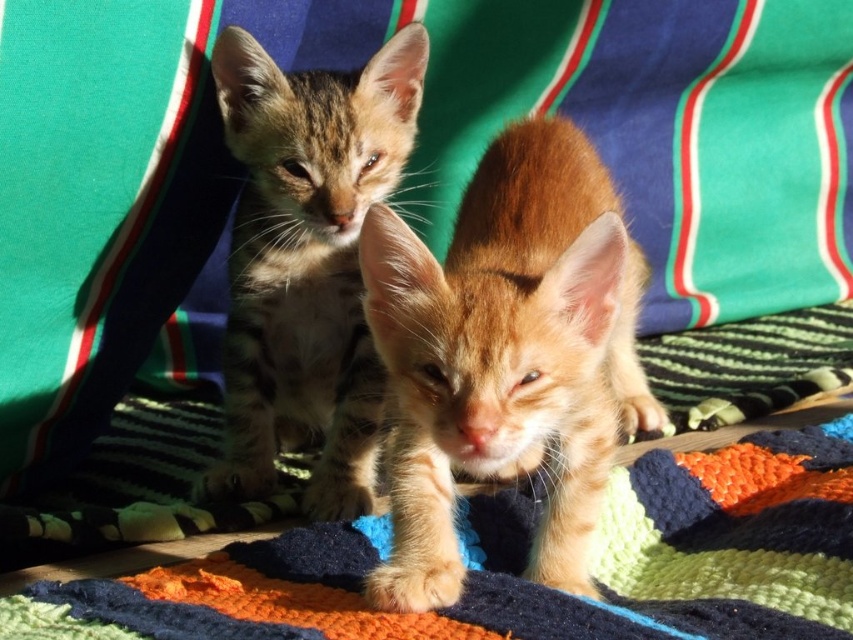
Question: Can you confirm if orange fur kitten at center is bigger than knitted wool blanket at center?

Choices:
 (A) no
 (B) yes

Answer: (B)

Question: Estimate the real-world distances between objects in this image. Which object is closer to the knitted wool blanket at center?

Choices:
 (A) tabby fur kitten at center
 (B) orange fur kitten at center

Answer: (B)

Question: Where is knitted wool blanket at center located in relation to tabby fur kitten at center in the image?

Choices:
 (A) above
 (B) below

Answer: (B)

Question: Is orange fur kitten at center closer to camera compared to knitted wool blanket at center?

Choices:
 (A) no
 (B) yes

Answer: (A)

Question: Among these points, which one is farthest from the camera?

Choices:
 (A) tap(251, 465)
 (B) tap(56, 595)

Answer: (A)

Question: Which of these objects is positioned closest to the knitted wool blanket at center?

Choices:
 (A) tabby fur kitten at center
 (B) orange fur kitten at center

Answer: (B)